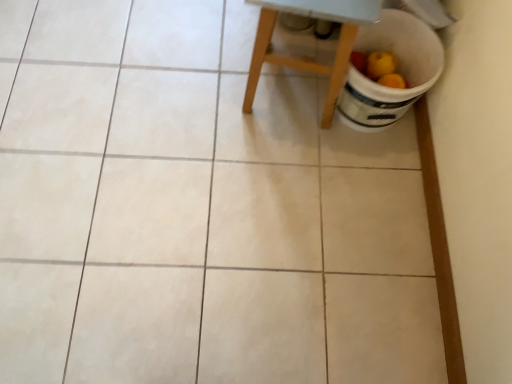
What do you see at coordinates (308, 59) in the screenshot?
I see `wooden stool at lower right` at bounding box center [308, 59].

Locate an element on the screen. wooden stool at lower right is located at coordinates (308, 59).

Measure the distance between point [323,117] and camera.

The distance of point [323,117] from camera is 4.40 feet.

Locate an element on the screen. The height and width of the screenshot is (384, 512). wooden stool at lower right is located at coordinates (308, 59).